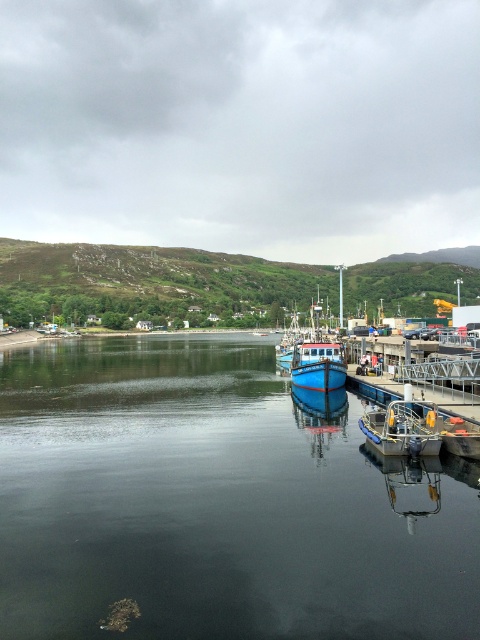
You are a photographer planning to capture the harbor scene. You want to ensure that both the smooth dark water at center and the blue matte boat at center are clearly visible in your shot. Given their sizes, which object should you focus on to ensure both are in frame without cropping?

The smooth dark water at center is larger in size than the blue matte boat at center, so focusing on the larger smooth dark water at center will ensure both objects are captured without cropping.

You are a photographer planning to capture the harbor scene. You need to ensure that the smooth dark water at center and the metallic blue boat at center are both in the frame. Given that your camera has a fixed field of view, which object requires more horizontal space to fully capture?

The smooth dark water at center requires more horizontal space to fully capture because its width surpasses that of the metallic blue boat at center.

You are standing at the edge of the harbor and want to board the metallic blue boat at center. If your walking speed is 1.5 meters per second, how many seconds will it take you to reach the boat?

The metallic blue boat at center is 20.81 meters away from the viewer. At a walking speed of 1.5 meters per second, it would take approximately 13.87 seconds to reach the boat.